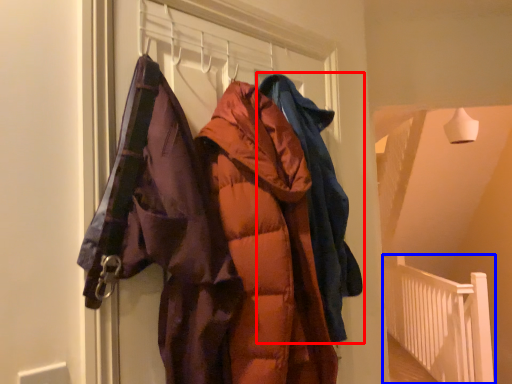
Question: Which object is further to the camera taking this photo, jacket (highlighted by a red box) or balustrade (highlighted by a blue box)?

Choices:
 (A) jacket
 (B) balustrade

Answer: (B)